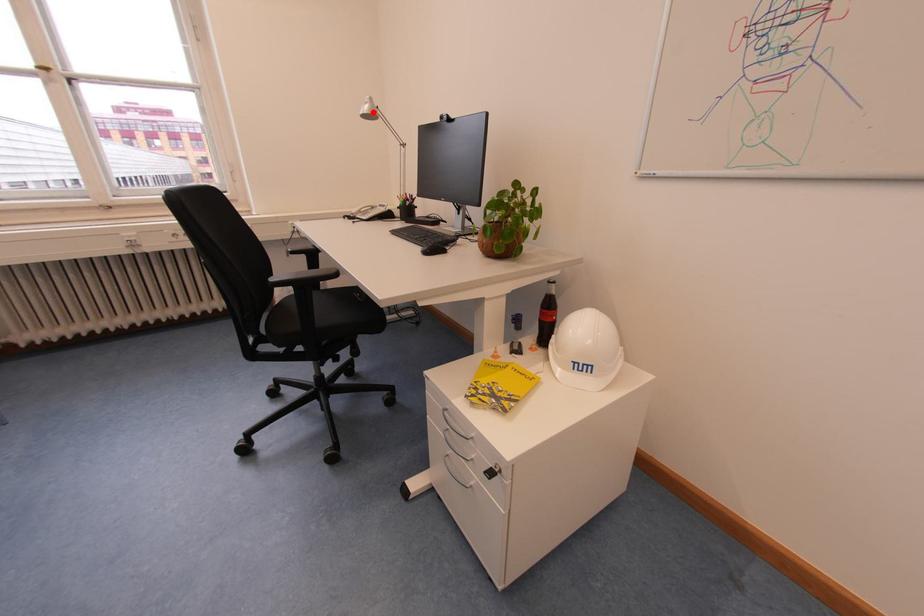
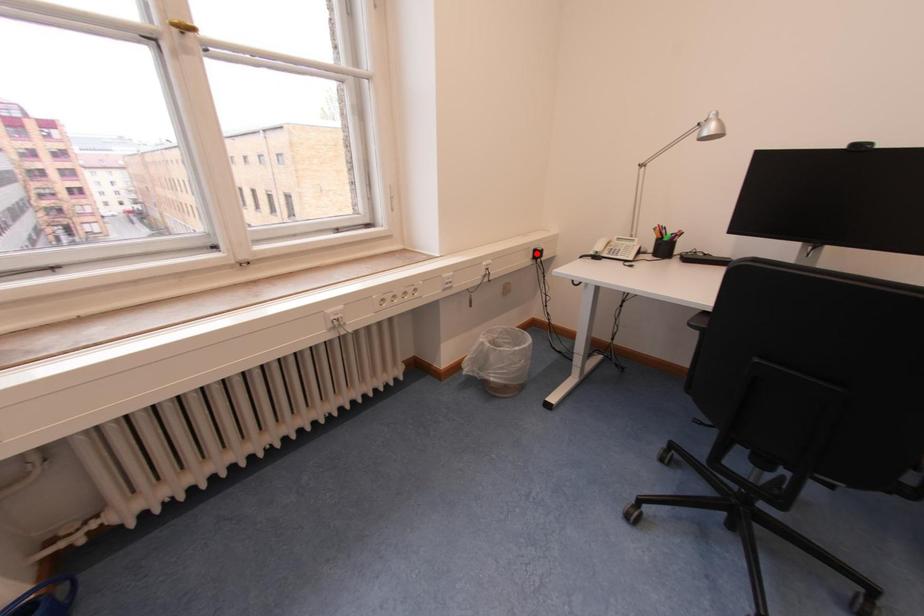
I am providing you with two images of the same scene from different viewpoints. A red point is marked on the first image and another point is marked on the second image. Do the highlighted points in image1 and image2 indicate the same real-world spot?

No